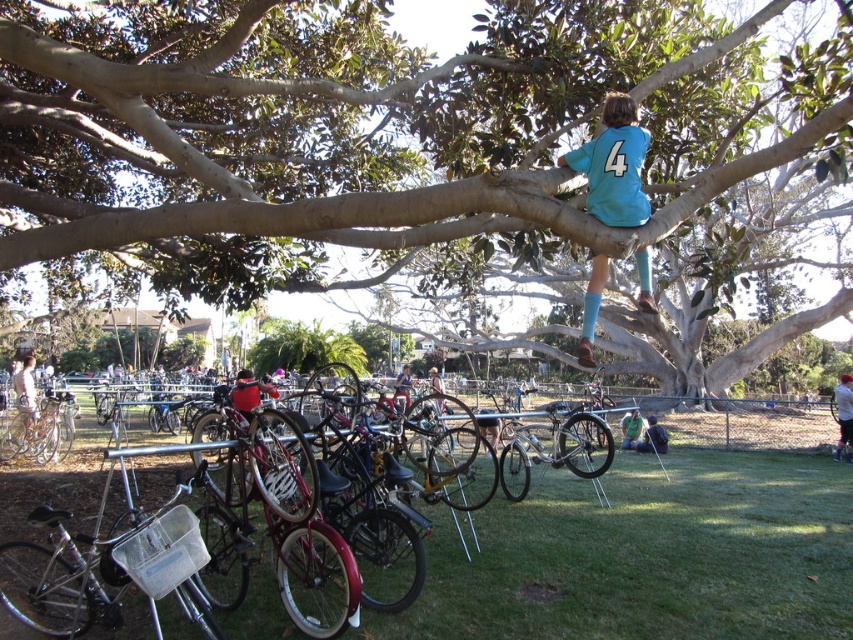
You are standing at the camera position and want to reach a specific point marked as point (258, 605). If your walking speed is 1.2 meters per second, how many seconds will it take you to reach that point?

The distance of point (258, 605) from camera is 5.74 meters. At a speed of 1.2 meters per second, it will take approximately 4.78 seconds to reach the point.

From the picture: You are a photographer trying to capture both the brown rough tree at upper center and the teal jersey at upper right in a single frame. Based on their positions, which object should you adjust your camera angle to focus on first to ensure both are in the shot?

The brown rough tree at upper center is to the right of the teal jersey at upper right, so you should first focus on the teal jersey at upper right to ensure both are within the frame.

You are a photographer standing in front of the tree. You want to take a photo of the metallic silver bicycle at center and the teal jersey at upper right. Which object will appear larger in your photo?

The metallic silver bicycle at center will appear larger in the photo because it is closer to the viewer than the teal jersey at upper right.